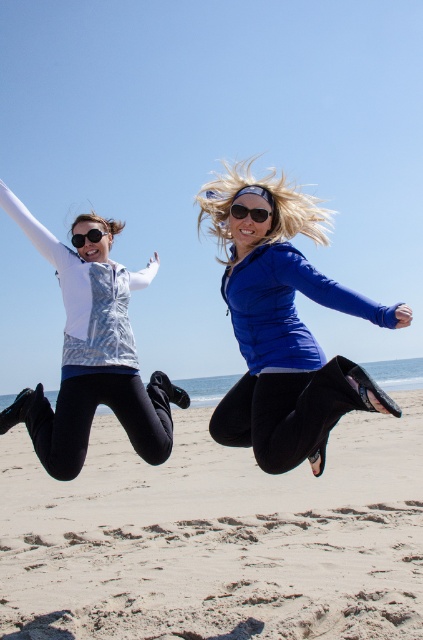
Can you confirm if blue matte jacket at center is taller than black plastic sunglasses at center?

Yes, blue matte jacket at center is taller than black plastic sunglasses at center.

Is blue matte jacket at center smaller than black plastic sunglasses at center?

No.

Between point (283, 353) and point (249, 212), which one is positioned in front?

Point (283, 353)

This screenshot has width=423, height=640. In order to click on blue matte jacket at center in this screenshot , I will do `click(283, 326)`.

Locate an element on the screen. black plastic sunglasses at center is located at coordinates (249, 212).

Can you confirm if black plastic sunglasses at center is taller than matte black sunglasses at upper left?

Incorrect, black plastic sunglasses at center's height is not larger of matte black sunglasses at upper left's.

Is point (249, 209) in front of point (82, 240)?

That is True.

You are a GUI agent. You are given a task and a screenshot of the screen. Output one action in this format:
    pyautogui.click(x=<x>, y=<y>)
    Task: Click on the black plastic sunglasses at center
    This screenshot has width=423, height=640.
    Given the screenshot: What is the action you would take?
    pyautogui.click(x=249, y=212)

Which is in front, point (90, 225) or point (98, 236)?

Point (98, 236) is in front.

Who is more distant from viewer, (68, 307) or (96, 232)?

The point (96, 232) is behind.

Who is more forward, (128, 362) or (98, 241)?

Positioned in front is point (128, 362).

This screenshot has width=423, height=640. What are the coordinates of `metallic silver vest at left` in the screenshot? It's located at coord(93,353).